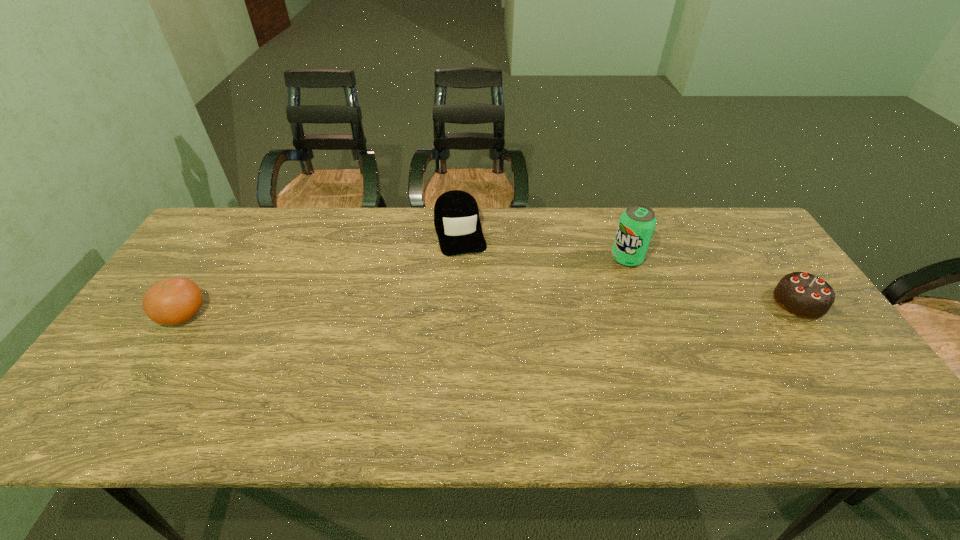
Find the location of a particular element. vacant area located 0.260m on the front-facing side of the tallest object is located at coordinates click(573, 317).

This screenshot has width=960, height=540. In order to click on vacant position located on the front-facing side of the tallest object in this screenshot , I will do `click(575, 315)`.

Where is `free space located 0.280m on the front-facing side of the tallest object`? The height and width of the screenshot is (540, 960). free space located 0.280m on the front-facing side of the tallest object is located at coordinates (568, 321).

Image resolution: width=960 pixels, height=540 pixels. I want to click on cap that is at the far edge, so coord(456,215).

Image resolution: width=960 pixels, height=540 pixels. Identify the location of pop soda located in the far edge section of the desktop. (637, 223).

Find the location of a particular element. The image size is (960, 540). object situated at the left edge is located at coordinates (173, 301).

Where is `object positioned at the right edge`? object positioned at the right edge is located at coordinates (804, 295).

Find the location of `vacant region at the far edge of the desktop`. vacant region at the far edge of the desktop is located at coordinates (609, 228).

Identify the location of vacant space at the near edge of the desktop. Image resolution: width=960 pixels, height=540 pixels. (365, 386).

I want to click on vacant area at the left edge, so click(x=156, y=326).